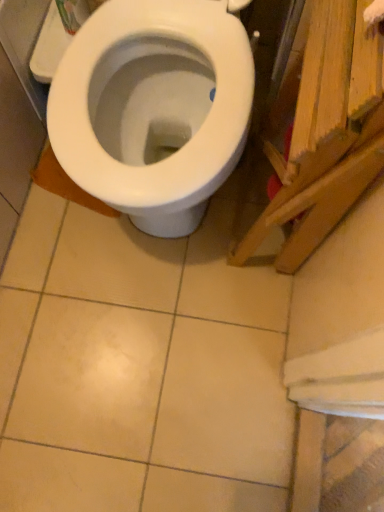
Where is `unoccupied area in front of white glossy bidet at center`? Image resolution: width=384 pixels, height=512 pixels. unoccupied area in front of white glossy bidet at center is located at coordinates (143, 348).